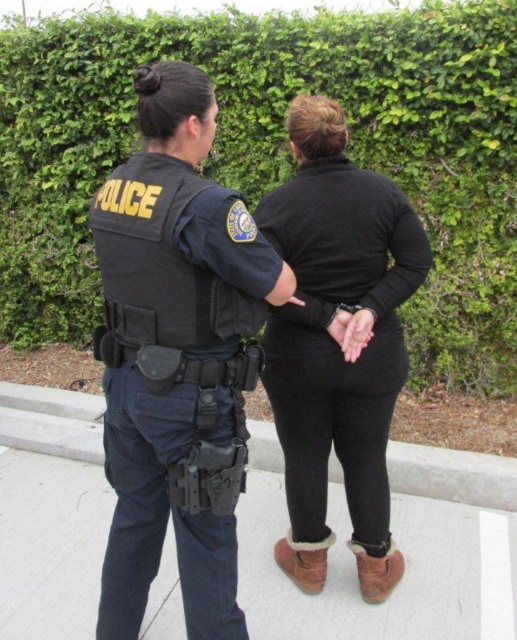
Question: Does green leafy hedge at upper center have a lesser width compared to gray concrete pavement at center?

Choices:
 (A) yes
 (B) no

Answer: (B)

Question: Which object is the farthest from the green leafy hedge at upper center?

Choices:
 (A) black tactical vest at center
 (B) gray concrete pavement at center
 (C) black matte sweater at center

Answer: (A)

Question: Can you confirm if green leafy hedge at upper center is bigger than black tactical vest at center?

Choices:
 (A) yes
 (B) no

Answer: (A)

Question: Does green leafy hedge at upper center have a greater width compared to black tactical vest at center?

Choices:
 (A) yes
 (B) no

Answer: (A)

Question: Which object appears farthest from the camera in this image?

Choices:
 (A) black matte sweater at center
 (B) green leafy hedge at upper center
 (C) black tactical vest at center
 (D) gray concrete pavement at center

Answer: (B)

Question: Which object is positioned farthest from the black tactical vest at center?

Choices:
 (A) gray concrete pavement at center
 (B) black matte sweater at center
 (C) green leafy hedge at upper center

Answer: (C)